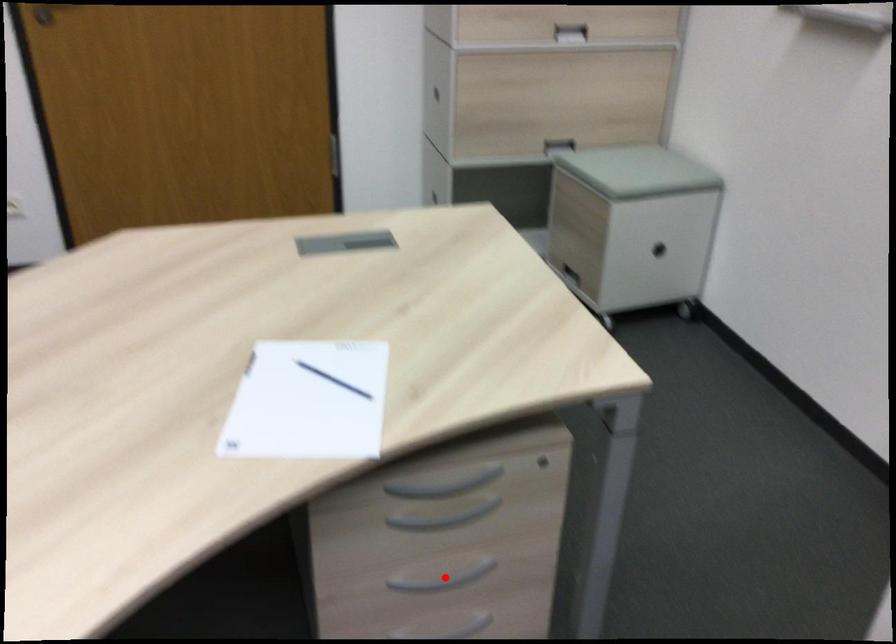
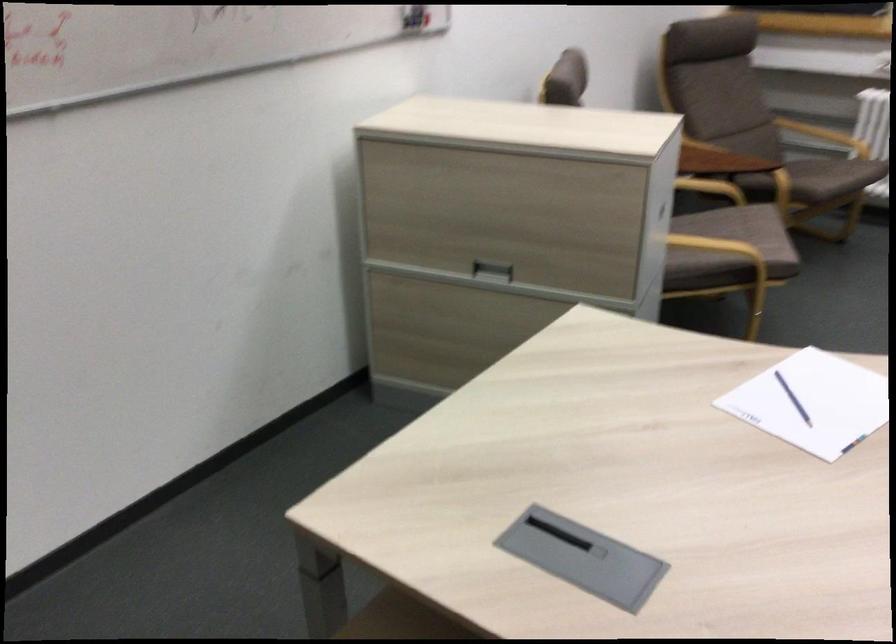
Question: I am providing you with two images of the same scene from different viewpoints. A red point is marked on the first image. At the location where the point appears in image 1, is it still visible in image 2?

Choices:
 (A) Yes
 (B) No

Answer: (B)